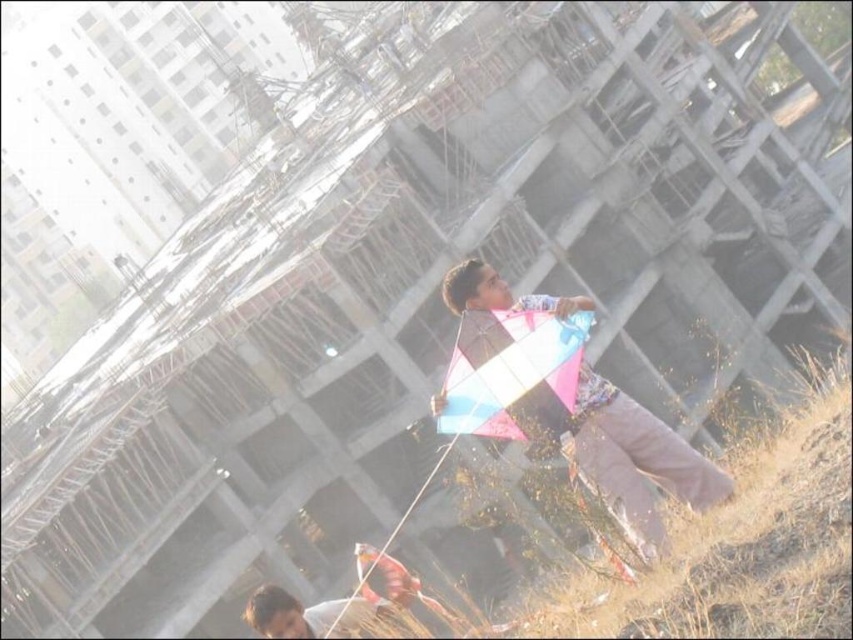
Question: Considering the relative positions of matte pink kite at center and translucent plastic kite at center in the image provided, where is matte pink kite at center located with respect to translucent plastic kite at center?

Choices:
 (A) below
 (B) above

Answer: (A)

Question: Considering the relative positions of matte pink kite at center and translucent plastic kite at center in the image provided, where is matte pink kite at center located with respect to translucent plastic kite at center?

Choices:
 (A) below
 (B) above

Answer: (A)

Question: Which point is farther to the camera?

Choices:
 (A) translucent plastic kite at center
 (B) matte pink kite at center

Answer: (A)

Question: Does matte pink kite at center have a lesser width compared to translucent plastic kite at center?

Choices:
 (A) yes
 (B) no

Answer: (B)